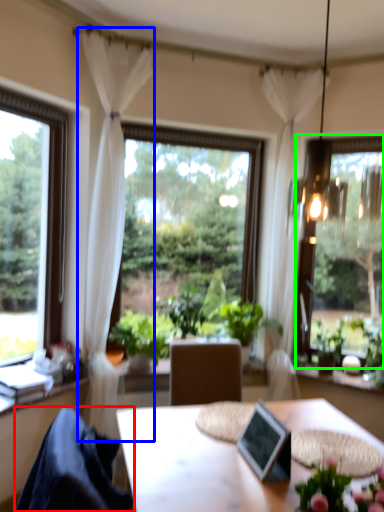
Question: Which is farther away from chair (highlighted by a red box)? curtain (highlighted by a blue box) or window (highlighted by a green box)?

Choices:
 (A) curtain
 (B) window

Answer: (B)